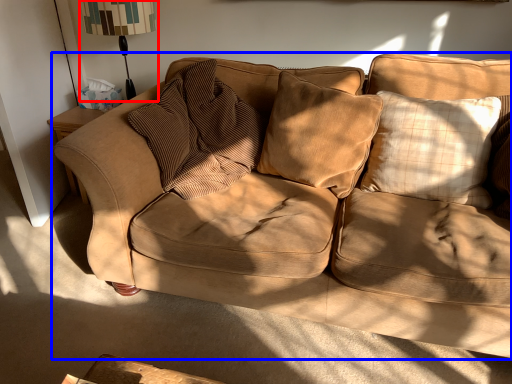
Question: Which point is further to the camera, table lamp (highlighted by a red box) or studio couch (highlighted by a blue box)?

Choices:
 (A) table lamp
 (B) studio couch

Answer: (A)